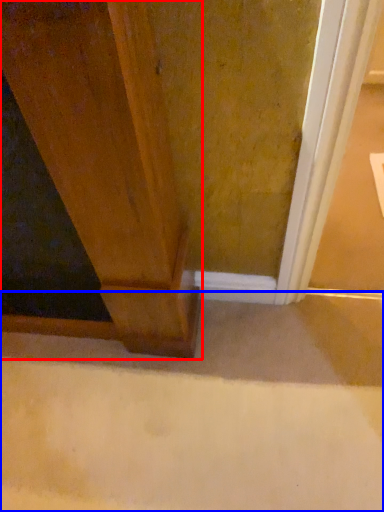
Question: Which object appears closest to the camera in this image, door (highlighted by a red box) or concrete (highlighted by a blue box)?

Choices:
 (A) door
 (B) concrete

Answer: (A)